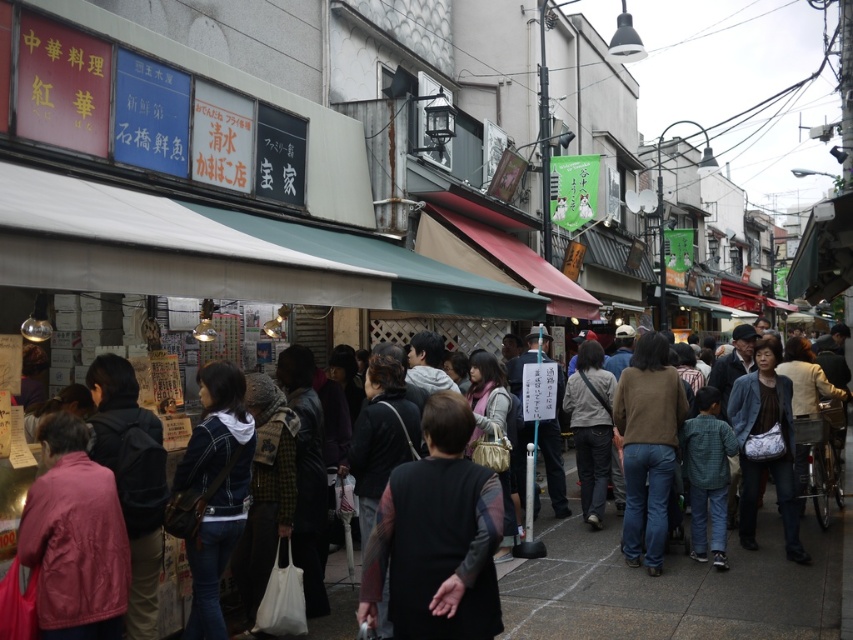
Question: Considering the relative positions of dark gray clothing at center and brown sweater at center in the image provided, where is dark gray clothing at center located with respect to brown sweater at center?

Choices:
 (A) left
 (B) right

Answer: (B)

Question: Which object is positioned closest to the dark gray clothing at center?

Choices:
 (A) brown sweater at center
 (B) black fabric vest at center

Answer: (A)

Question: Is dark gray clothing at center wider than brown sweater at center?

Choices:
 (A) yes
 (B) no

Answer: (A)

Question: Which of the following is the farthest from the observer?

Choices:
 (A) dark gray clothing at center
 (B) brown sweater at center
 (C) black fabric vest at center

Answer: (B)

Question: Where is black fabric vest at center located in relation to brown sweater at center in the image?

Choices:
 (A) right
 (B) left

Answer: (B)

Question: Estimate the real-world distances between objects in this image. Which object is farther from the black fabric vest at center?

Choices:
 (A) dark gray clothing at center
 (B) brown sweater at center

Answer: (B)